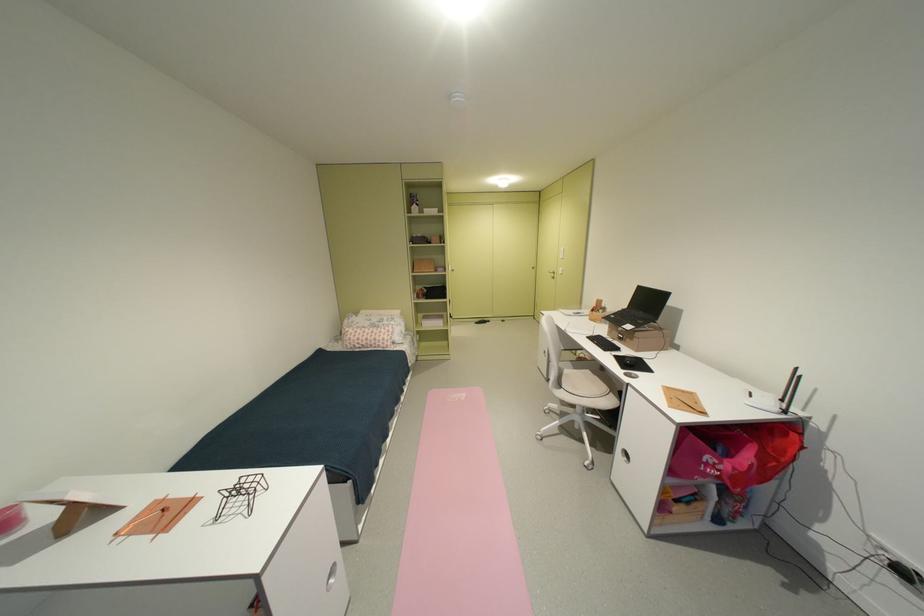
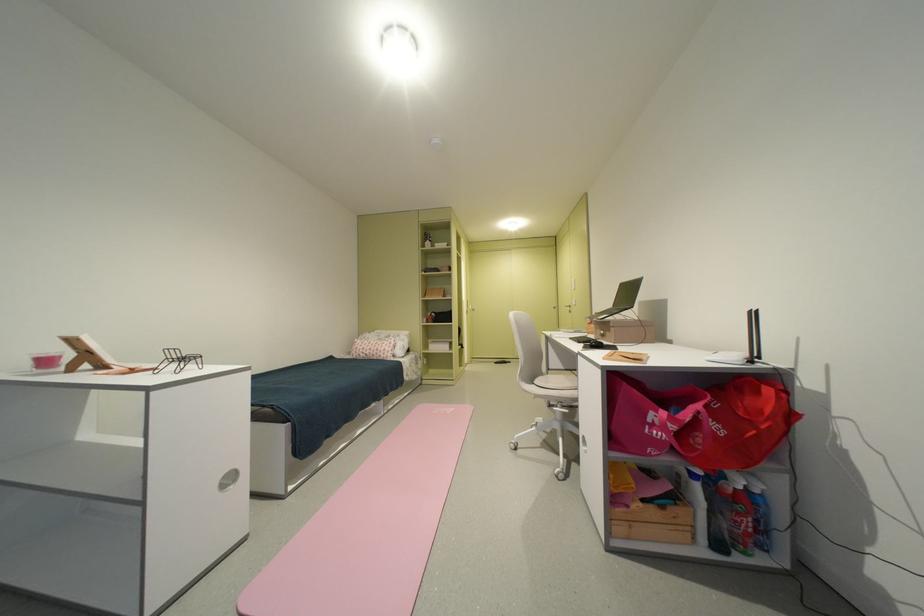
Locate, in the second image, the point that corresponds to the point at 681,514 in the first image.

(638, 508)